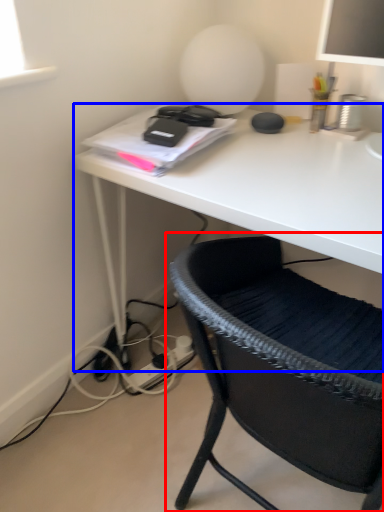
Question: Which object appears farthest to the camera in this image, chair (highlighted by a red box) or desk (highlighted by a blue box)?

Choices:
 (A) chair
 (B) desk

Answer: (B)